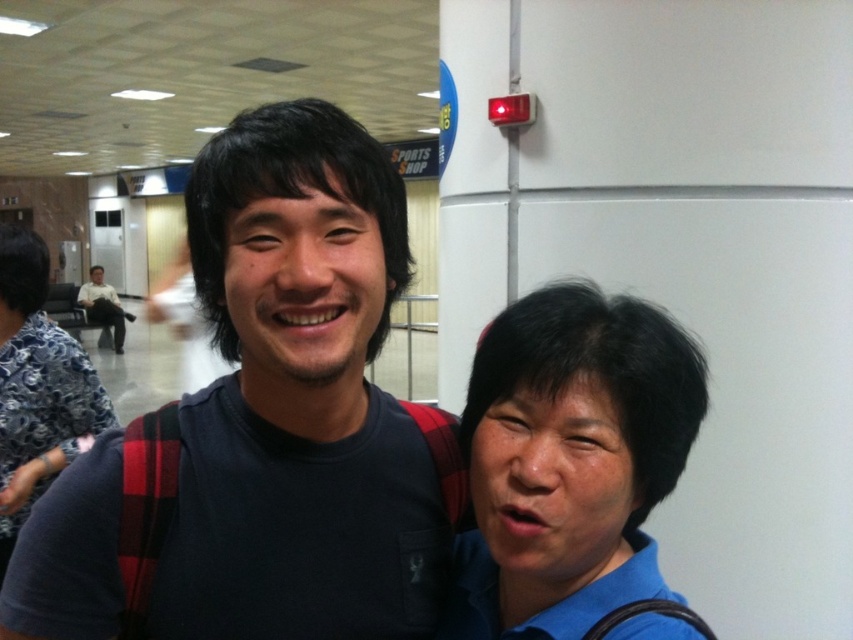
Is blue fabric shirt at right above floral-patterned shirt at left?

Incorrect, blue fabric shirt at right is not positioned above floral-patterned shirt at left.

Who is lower down, blue fabric shirt at right or floral-patterned shirt at left?

Positioned lower is blue fabric shirt at right.

Identify the location of blue fabric shirt at right. (569, 460).

Is point (15, 490) positioned behind point (100, 307)?

That is False.

Which of these two, floral-patterned shirt at left or matte black shirt at left, stands taller?

With more height is matte black shirt at left.

Identify the location of floral-patterned shirt at left. The height and width of the screenshot is (640, 853). click(x=38, y=387).

This screenshot has width=853, height=640. In order to click on floral-patterned shirt at left in this screenshot , I will do `click(38, 387)`.

Based on the photo, which is above, blue fabric shirt at right or matte black shirt at left?

matte black shirt at left

Which is in front, point (547, 436) or point (86, 292)?

Positioned in front is point (547, 436).

The width and height of the screenshot is (853, 640). I want to click on blue fabric shirt at right, so click(569, 460).